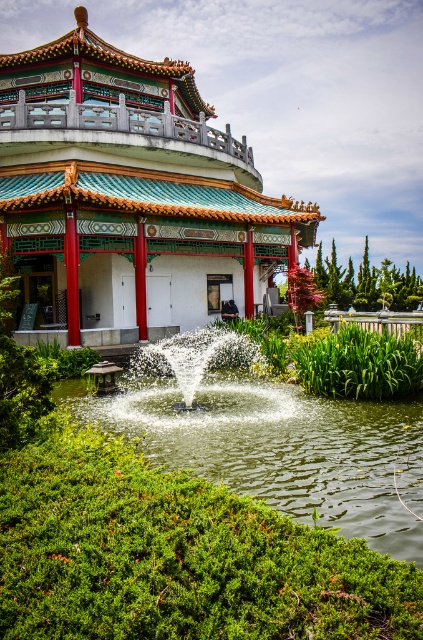
You are an architect designing a new garden layout. You need to place a small statue that requires a base at least 2 meters tall. Given the scene, which object between the teal glazed tiles at center and the green grassy lake at center would be suitable for placing the statue?

The teal glazed tiles at center is taller than the green grassy lake at center, so the teal glazed tiles at center would be suitable for placing the statue as it meets the height requirement of at least 2 meters.

You are standing in front of the pavilion and want to walk towards the green grassy lake at center and the white frothy water at center. Which one will you reach first?

You will reach the green grassy lake at center first because it is closer to you than the white frothy water at center.

You are standing in the pavilion and notice a specific point marked at coordinates (x=129, y=196). What is located at that point?

The point at coordinates (x=129, y=196) marks the location of the teal glazed tiles at center.